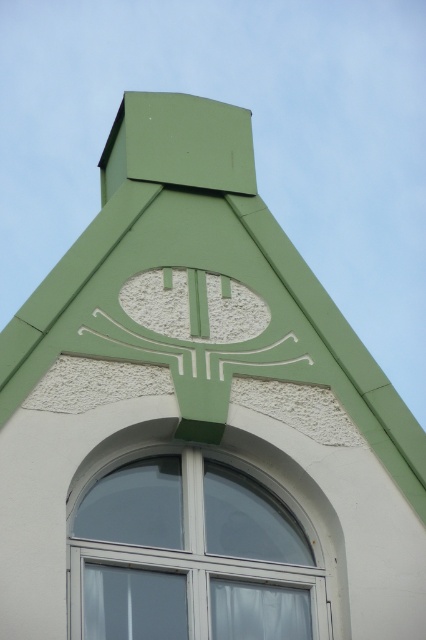
Question: Among these objects, which one is farthest from the camera?

Choices:
 (A) white plastic window at center
 (B) green matte roof at center

Answer: (B)

Question: Is the position of green matte roof at center more distant than that of white plastic window at center?

Choices:
 (A) no
 (B) yes

Answer: (B)

Question: Does green matte roof at center appear over white plastic window at center?

Choices:
 (A) yes
 (B) no

Answer: (A)

Question: Where is green matte roof at center located in relation to white plastic window at center in the image?

Choices:
 (A) below
 (B) above

Answer: (B)

Question: Which point is farther to the camera?

Choices:
 (A) green matte roof at center
 (B) white plastic window at center

Answer: (A)